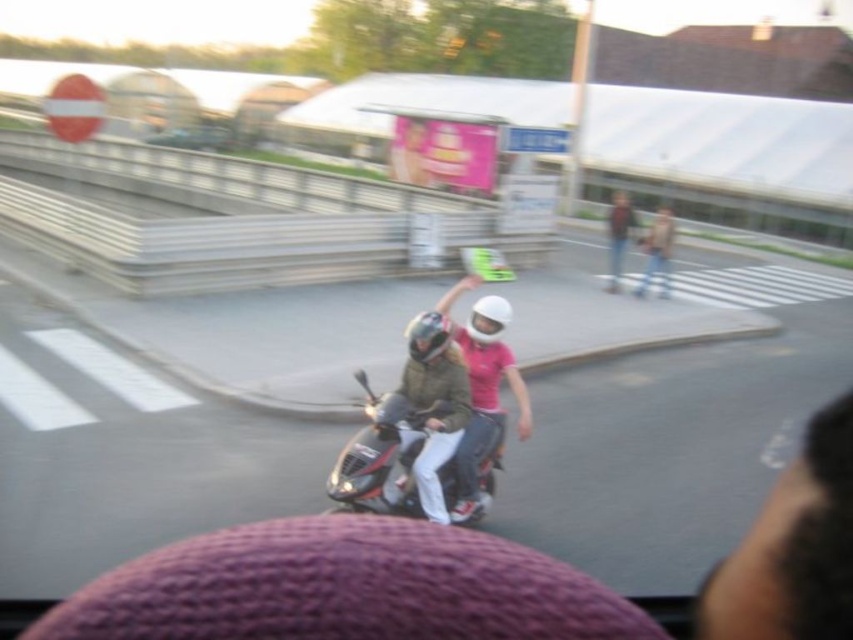
In the scene shown: You are a passenger in the car and looking out the window. You see a shiny metallic scooter at center and a matte white helmet at center. Which object is closer to you?

The shiny metallic scooter at center is closer to the viewer than the matte white helmet at center.

You are a passenger in a car and looking out the window. You see a shiny metallic scooter at center and a matte white helmet at center. Which object is closer to the left edge of your view?

The shiny metallic scooter at center is positioned on the left side of the matte white helmet at center, so it is closer to the left edge of your view.